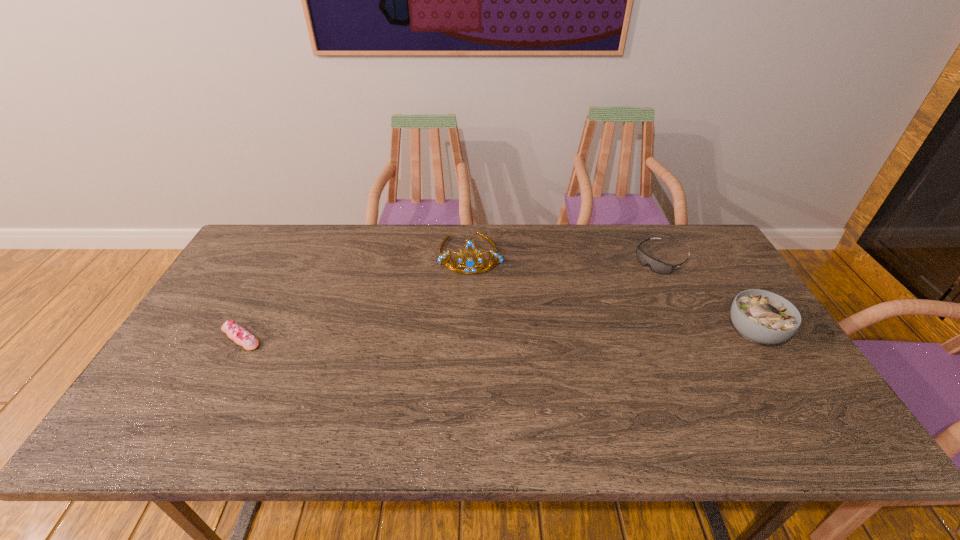
I want to click on vacant space situated on the front-facing side of the tallest object, so click(x=470, y=298).

Where is `free space located 0.350m on the lenses of the goggles`? free space located 0.350m on the lenses of the goggles is located at coordinates (572, 322).

Where is `free space located 0.070m on the lenses of the goggles`? free space located 0.070m on the lenses of the goggles is located at coordinates (633, 280).

The height and width of the screenshot is (540, 960). In order to click on free space located 0.310m on the lenses of the goggles in this screenshot , I will do `click(582, 316)`.

I want to click on tiara present at the far edge, so click(470, 264).

At what (x,y) coordinates should I click in order to perform the action: click on goggles present at the far edge. Please return your answer as a coordinate pair (x, y). Looking at the image, I should click on (656, 266).

The width and height of the screenshot is (960, 540). I want to click on object at the left edge, so click(242, 337).

Locate an element on the screen. This screenshot has height=540, width=960. soup bowl that is at the right edge is located at coordinates (760, 316).

You are a GUI agent. You are given a task and a screenshot of the screen. Output one action in this format:
    pyautogui.click(x=<x>, y=<y>)
    Task: Click on the goggles that is at the right edge
    Image resolution: width=960 pixels, height=540 pixels.
    Given the screenshot: What is the action you would take?
    pyautogui.click(x=656, y=266)

Image resolution: width=960 pixels, height=540 pixels. Find the location of `object that is at the far right corner`. object that is at the far right corner is located at coordinates (656, 266).